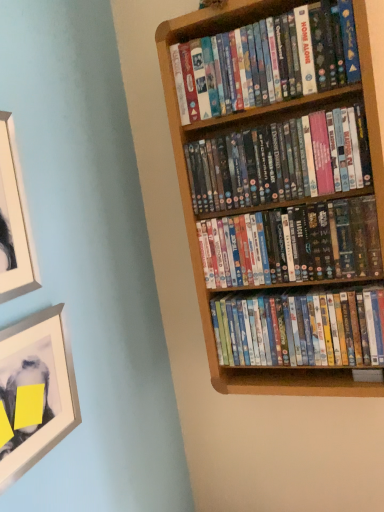
Question: Should I look upward or downward to see metallic silver picture frame at lower left, which is the 1th picture frame in bottom-to-top order?

Choices:
 (A) down
 (B) up

Answer: (A)

Question: Can you confirm if matte cardboard book at upper right, the fourth book ordered from the bottom, is positioned to the left of light brown wood bookcase at upper right?

Choices:
 (A) yes
 (B) no

Answer: (A)

Question: Is matte cardboard book at upper right, the fourth book ordered from the bottom, taller than light brown wood bookcase at upper right?

Choices:
 (A) no
 (B) yes

Answer: (A)

Question: Does matte cardboard book at upper right, the 1th book from the top, have a lesser width compared to light brown wood bookcase at upper right?

Choices:
 (A) no
 (B) yes

Answer: (A)

Question: Is the position of matte cardboard book at upper right, the 1th book from the top, more distant than that of light brown wood bookcase at upper right?

Choices:
 (A) no
 (B) yes

Answer: (A)

Question: From the image's perspective, does matte cardboard book at upper right, the fourth book ordered from the bottom, appear lower than light brown wood bookcase at upper right?

Choices:
 (A) no
 (B) yes

Answer: (A)

Question: Does matte cardboard book at upper right, the 1th book from the top, lie in front of light brown wood bookcase at upper right?

Choices:
 (A) no
 (B) yes

Answer: (B)

Question: Are multicolored plastic dvds at center, which appears as the 3th book when viewed from the top, and metallic silver picture frame at lower left, placed as the 2th picture frame when sorted from top to bottom, making contact?

Choices:
 (A) no
 (B) yes

Answer: (A)

Question: Is multicolored plastic dvds at center, the 2th book from the bottom, positioned behind metallic silver picture frame at lower left, which is the 1th picture frame in bottom-to-top order?

Choices:
 (A) no
 (B) yes

Answer: (B)

Question: Is multicolored plastic dvds at center, the 2th book from the bottom, aimed at metallic silver picture frame at lower left, which is the 1th picture frame in bottom-to-top order?

Choices:
 (A) no
 (B) yes

Answer: (B)

Question: Is multicolored plastic dvds at center, which appears as the 3th book when viewed from the top, positioned with its back to metallic silver picture frame at lower left, which is the 1th picture frame in bottom-to-top order?

Choices:
 (A) yes
 (B) no

Answer: (B)

Question: Would you say metallic silver picture frame at lower left, which is the 1th picture frame in bottom-to-top order, is part of multicolored plastic dvds at center, the 2th book from the bottom,'s contents?

Choices:
 (A) no
 (B) yes

Answer: (A)

Question: Is multicolored plastic dvds at center, which appears as the 3th book when viewed from the top, to the right of metallic silver picture frame at lower left, placed as the 2th picture frame when sorted from top to bottom, from the viewer's perspective?

Choices:
 (A) no
 (B) yes

Answer: (B)

Question: Is matte cardboard book at upper right, the 1th book from the top, aimed at white matte picture frame at upper left, arranged as the 1th picture frame when viewed from the top?

Choices:
 (A) no
 (B) yes

Answer: (A)